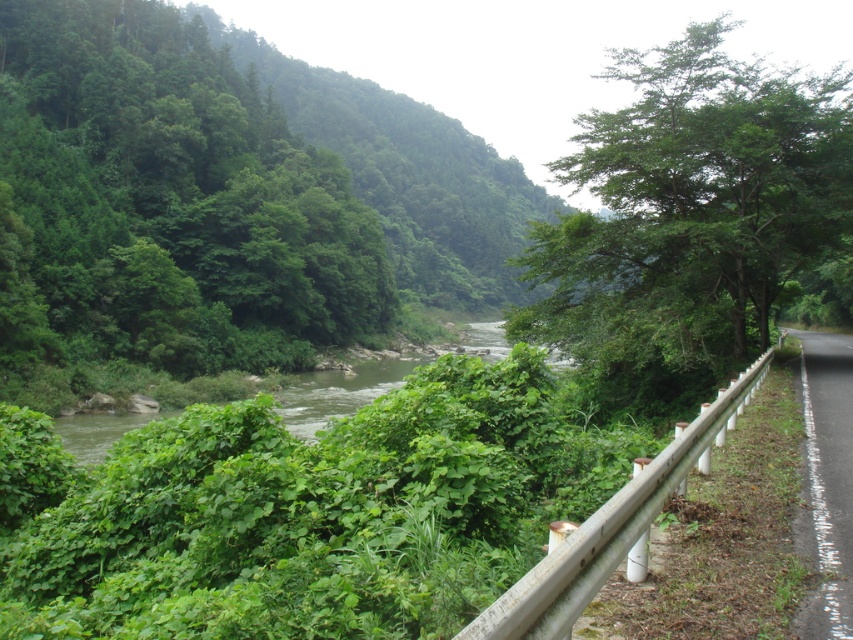
Question: Among these objects, which one is farthest from the camera?

Choices:
 (A) green leafy tree at left
 (B) white asphalt road at right

Answer: (A)

Question: Which point is closer to the camera?

Choices:
 (A) green leafy tree at left
 (B) green leafy tree at right

Answer: (B)

Question: Is green leafy tree at left to the left of green leafy river at center from the viewer's perspective?

Choices:
 (A) yes
 (B) no

Answer: (A)

Question: Among these objects, which one is nearest to the camera?

Choices:
 (A) green leafy river at center
 (B) green leafy tree at left
 (C) green leafy tree at right

Answer: (A)

Question: From the image, what is the correct spatial relationship of green leafy tree at left in relation to green leafy river at center?

Choices:
 (A) right
 (B) left

Answer: (B)

Question: Can you confirm if green leafy tree at right is smaller than white asphalt road at right?

Choices:
 (A) yes
 (B) no

Answer: (B)